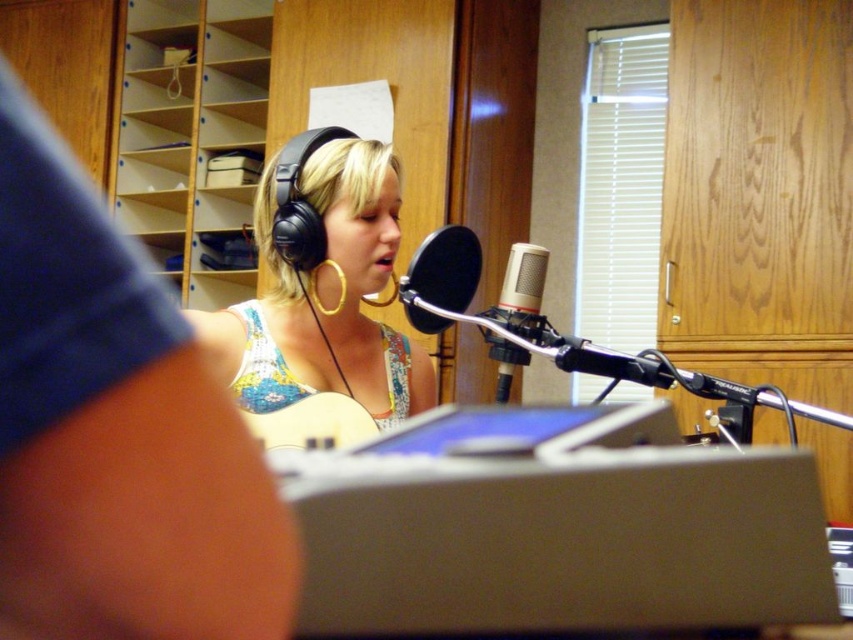
Question: Is black matte headphones at upper left bigger than light wood bookshelf at upper left?

Choices:
 (A) yes
 (B) no

Answer: (B)

Question: Which object is positioned closest to the silver metallic microphone at center?

Choices:
 (A) black matte microphone at center
 (B) light wood bookshelf at upper left

Answer: (A)

Question: Among these objects, which one is farthest from the camera?

Choices:
 (A) silver metallic microphone at center
 (B) black matte headphones at upper left
 (C) matte floral dress at center
 (D) light wood bookshelf at upper left

Answer: (D)

Question: Is floral fabric bikini top at center to the left of silver metallic microphone at center from the viewer's perspective?

Choices:
 (A) no
 (B) yes

Answer: (B)

Question: Can you confirm if black matte headphones at upper left is wider than black matte microphone at center?

Choices:
 (A) no
 (B) yes

Answer: (A)

Question: Among these points, which one is farthest from the camera?

Choices:
 (A) tap(228, 365)
 (B) tap(422, 266)
 (C) tap(538, 300)

Answer: (A)